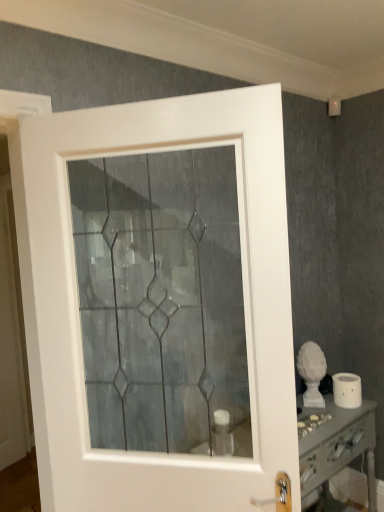
Question: From a real-world perspective, is white glossy vanity at lower right on white matte toilet paper at lower right?

Choices:
 (A) yes
 (B) no

Answer: (B)

Question: From the image's perspective, would you say white glossy vanity at lower right is shown under white matte toilet paper at lower right?

Choices:
 (A) no
 (B) yes

Answer: (B)

Question: From the image's perspective, does white glossy vanity at lower right appear higher than white matte toilet paper at lower right?

Choices:
 (A) yes
 (B) no

Answer: (B)

Question: Does white glossy vanity at lower right lie behind white matte toilet paper at lower right?

Choices:
 (A) yes
 (B) no

Answer: (B)

Question: Is white glossy vanity at lower right at the left side of white matte toilet paper at lower right?

Choices:
 (A) no
 (B) yes

Answer: (B)

Question: Considering the relative sizes of white glossy vanity at lower right and white matte toilet paper at lower right in the image provided, is white glossy vanity at lower right shorter than white matte toilet paper at lower right?

Choices:
 (A) no
 (B) yes

Answer: (A)

Question: From a real-world perspective, does white glossy vanity at lower right sit lower than white glossy door at center?

Choices:
 (A) no
 (B) yes

Answer: (B)

Question: Is white glossy vanity at lower right next to white glossy door at center and touching it?

Choices:
 (A) yes
 (B) no

Answer: (B)

Question: From the image's perspective, does white glossy vanity at lower right appear higher than white glossy door at center?

Choices:
 (A) no
 (B) yes

Answer: (A)

Question: Is white glossy vanity at lower right thinner than white glossy door at center?

Choices:
 (A) no
 (B) yes

Answer: (A)

Question: Is white glossy vanity at lower right oriented away from white glossy door at center?

Choices:
 (A) yes
 (B) no

Answer: (B)

Question: From the image's perspective, is white glossy vanity at lower right located beneath white glossy door at center?

Choices:
 (A) yes
 (B) no

Answer: (A)

Question: Can you confirm if white matte toilet paper at lower right is taller than white glossy vanity at lower right?

Choices:
 (A) no
 (B) yes

Answer: (A)